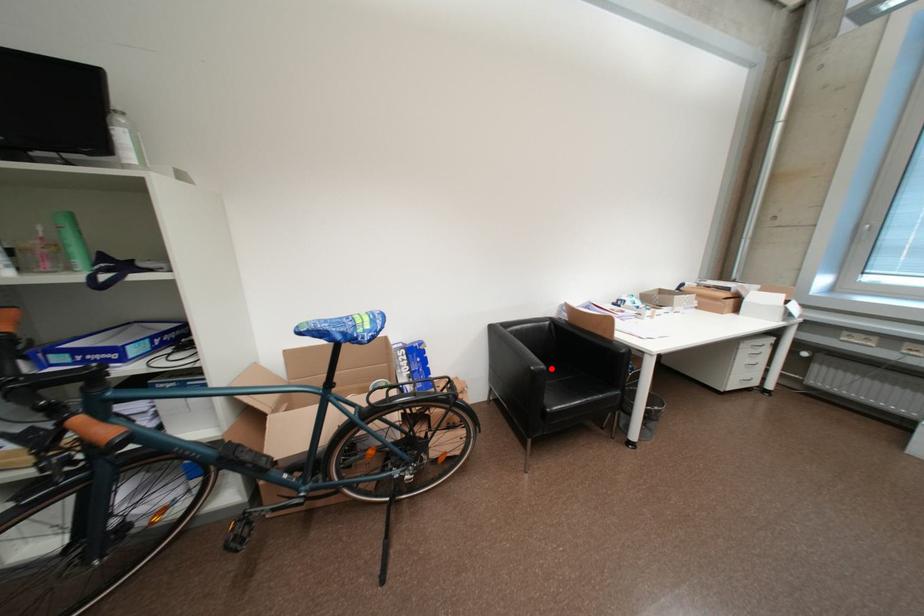
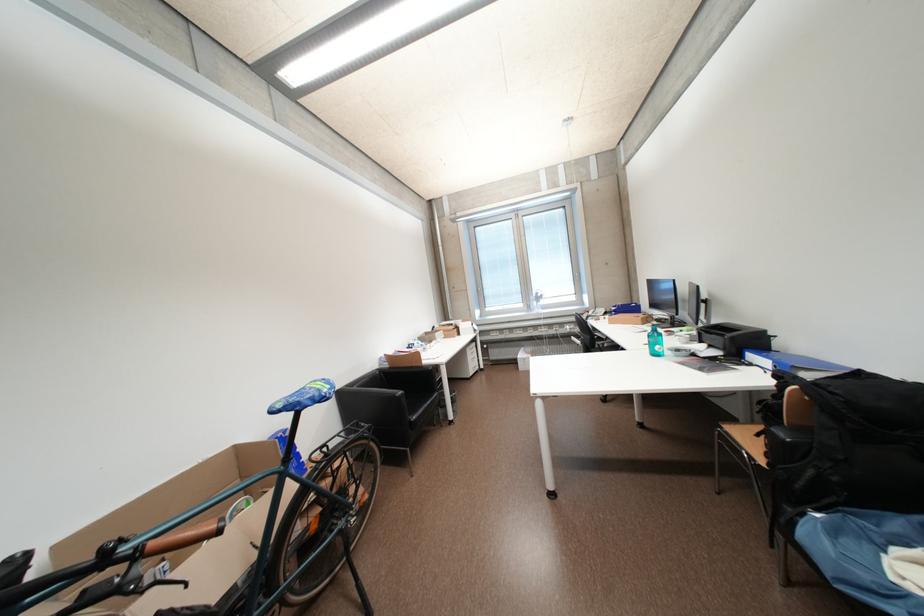
In the second image, find the point that corresponds to the highlighted location in the first image.

(408, 394)